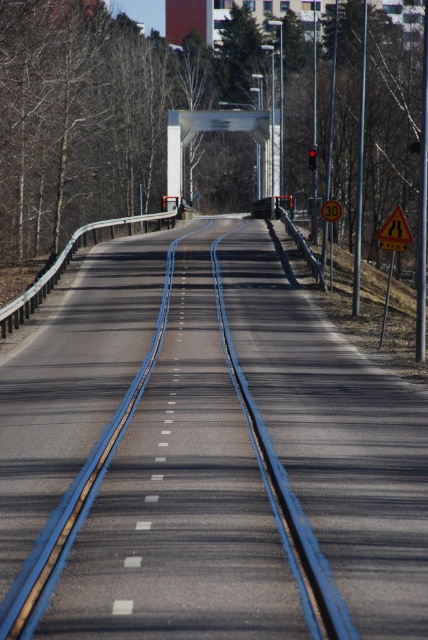
You are driving a car and see the brown leafless tree at center and the yellow reflective triangle at center ahead on the road. Which object will you reach first?

The brown leafless tree at center is closer to you than the yellow reflective triangle at center, so you will reach the brown leafless tree at center first.

In the scene shown: You are driving a car and see the brown leafless tree at center and the yellow reflective triangle at center ahead on the road. Which object will you pass first?

The brown leafless tree at center is to the left of the yellow reflective triangle at center, so you will pass the brown leafless tree at center first.

You are driving a car and see the brown leafless tree at center and the yellow reflective triangle at center. Which object is positioned higher from the ground?

The brown leafless tree at center is located above the yellow reflective triangle at center, so the brown leafless tree at center is higher from the ground.